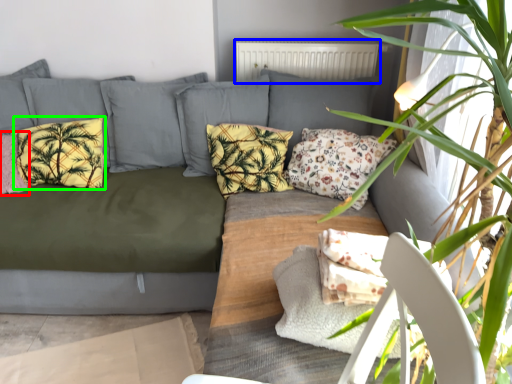
Question: Which object is positioned closest to pillow (highlighted by a red box)? Select from radiator (highlighted by a blue box) and pillow (highlighted by a green box).

Choices:
 (A) radiator
 (B) pillow

Answer: (B)